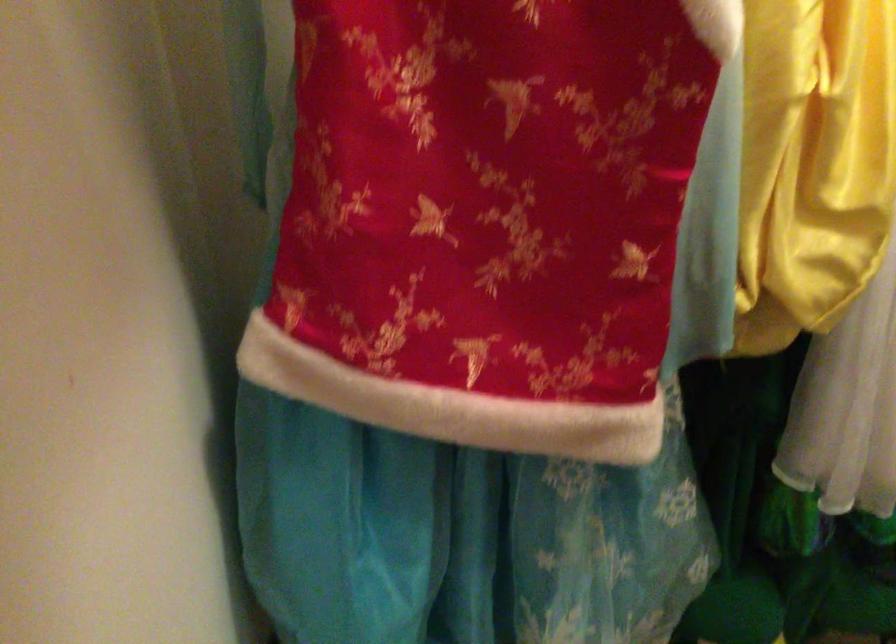
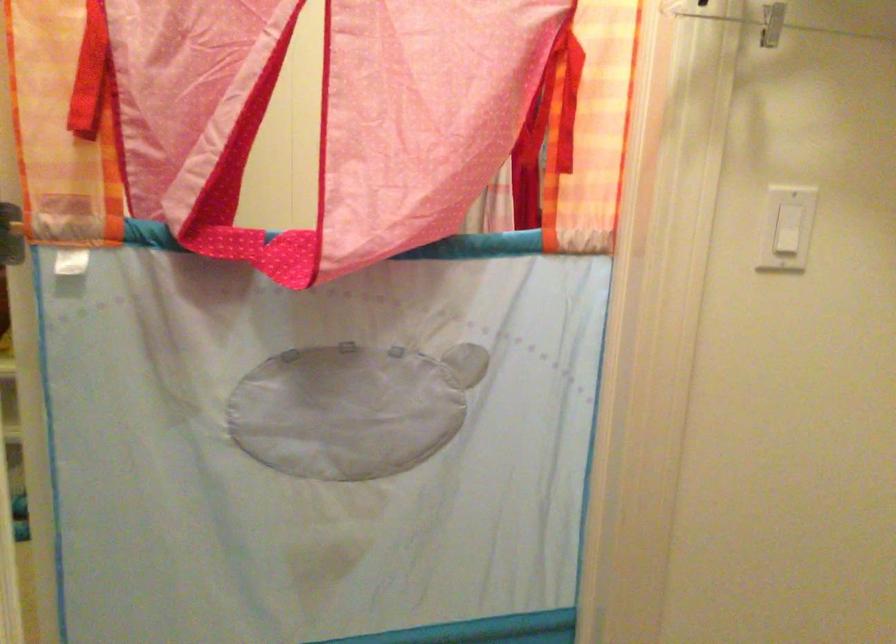
Question: The camera is either moving clockwise (left) or counter-clockwise (right) around the object. The first image is from the beginning of the video and the second image is from the end. Is the camera moving left or right when shooting the video?

Choices:
 (A) Left
 (B) Right

Answer: (A)